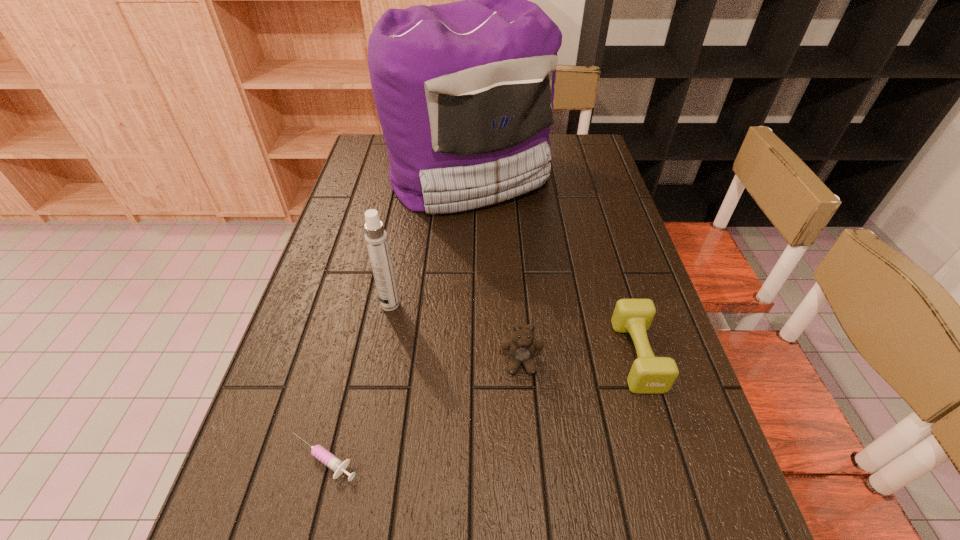
This screenshot has width=960, height=540. In order to click on vacant point at the right edge in this screenshot , I will do `click(566, 176)`.

In the image, there is a desktop. At what (x,y) coordinates should I click in order to perform the action: click on free space at the far right corner. Please return your answer as a coordinate pair (x, y). Looking at the image, I should click on (600, 150).

Locate an element on the screen. The height and width of the screenshot is (540, 960). vacant space that's between the third shortest object and the fourth tallest object is located at coordinates (579, 359).

Image resolution: width=960 pixels, height=540 pixels. I want to click on vacant space that's between the farthest object and the syringe, so click(396, 317).

The height and width of the screenshot is (540, 960). I want to click on free space between the teddy bear and the rightmost object, so click(x=579, y=359).

Image resolution: width=960 pixels, height=540 pixels. What are the coordinates of `free space between the aerosol can and the syringe` in the screenshot? It's located at (357, 382).

Locate an element on the screen. Image resolution: width=960 pixels, height=540 pixels. free spot between the third shortest object and the second farthest object is located at coordinates (456, 334).

Where is `free space between the dumbbell and the farthest object`? The width and height of the screenshot is (960, 540). free space between the dumbbell and the farthest object is located at coordinates (553, 266).

Find the location of a particular element. The width and height of the screenshot is (960, 540). free spot between the teddy bear and the dumbbell is located at coordinates (579, 359).

What are the coordinates of `vacant space that is in between the shortest object and the fourth nearest object` in the screenshot? It's located at (357, 382).